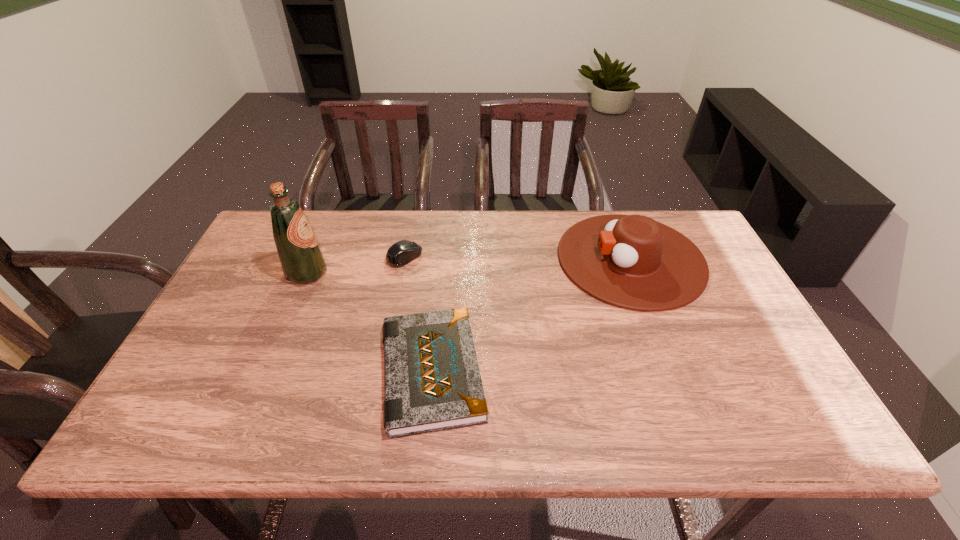
This screenshot has width=960, height=540. I want to click on vacant area between the olive oil and the rightmost object, so click(468, 266).

This screenshot has height=540, width=960. Identify the location of object that is the second closest to the mouse. 432,382.

Locate an element on the screen. The image size is (960, 540). object that stands as the closest to the cowboy hat is located at coordinates (432, 382).

I want to click on free space that satisfies the following two spatial constraints: 1. on the back side of the nearest object; 2. on the front-facing side of the olive oil, so click(442, 273).

Identify the location of vacant space that satisfies the following two spatial constraints: 1. on the front side of the mouse; 2. on the front-facing side of the olive oil. (401, 273).

Image resolution: width=960 pixels, height=540 pixels. Find the location of `free location that satisfies the following two spatial constraints: 1. on the front-facing side of the notebook; 2. on the left side of the tallest object`. free location that satisfies the following two spatial constraints: 1. on the front-facing side of the notebook; 2. on the left side of the tallest object is located at coordinates (265, 372).

You are a GUI agent. You are given a task and a screenshot of the screen. Output one action in this format:
    pyautogui.click(x=<x>, y=<y>)
    Task: Click on the vacant region that satisfies the following two spatial constraints: 1. on the front-facing side of the tallest object; 2. on the right side of the notebook
    
    Given the screenshot: What is the action you would take?
    pyautogui.click(x=265, y=372)

Find the location of a particular element. vacant region that satisfies the following two spatial constraints: 1. on the front-facing side of the rightmost object; 2. on the front side of the notebook is located at coordinates (674, 372).